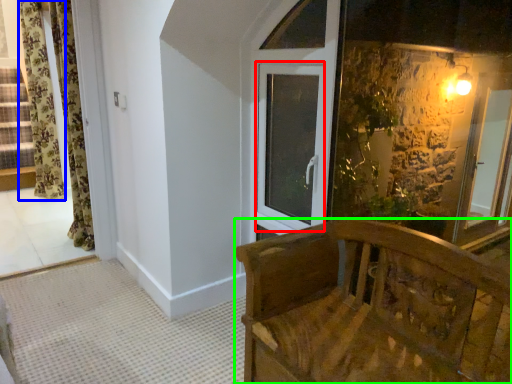
Question: Which is nearer to the window (highlighted by a red box)? curtain (highlighted by a blue box) or furniture (highlighted by a green box).

Choices:
 (A) curtain
 (B) furniture

Answer: (B)